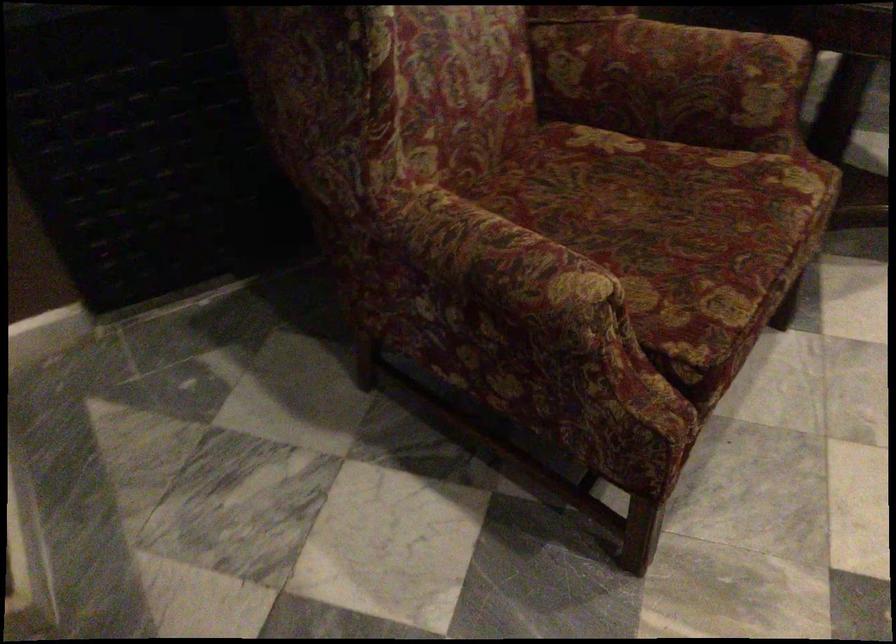
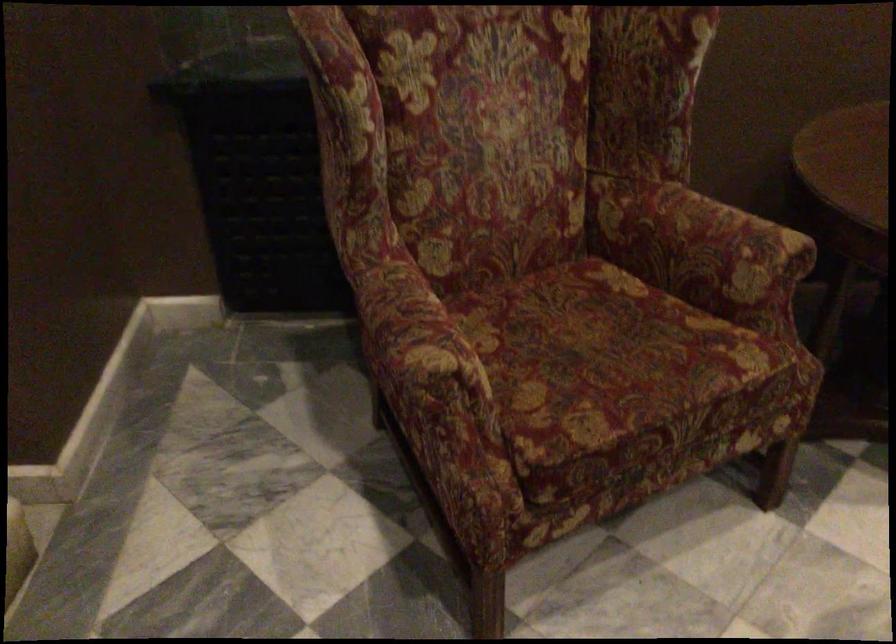
The point at (676, 229) is marked in the first image. Where is the corresponding point in the second image?

(606, 361)